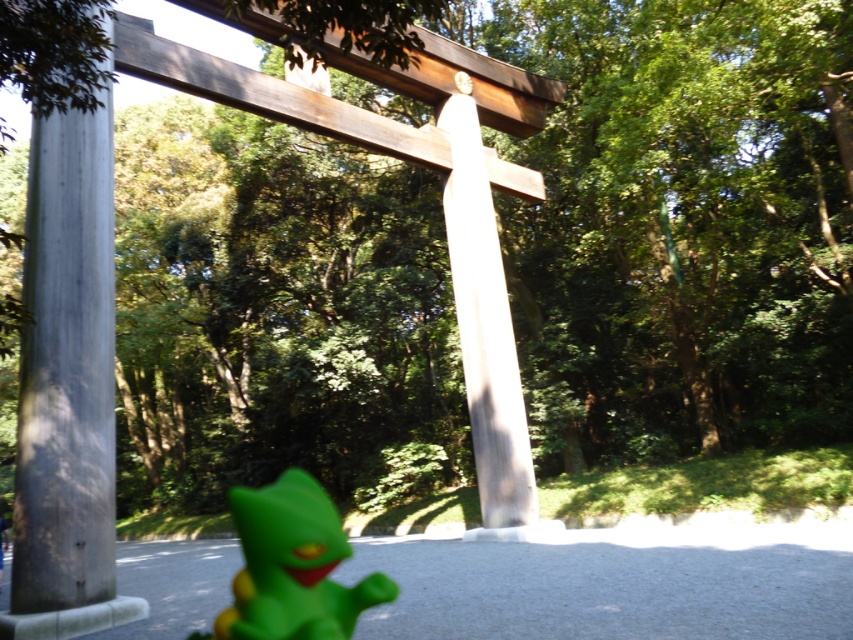
Question: Does smooth gray pole at left appear over smooth white pillar at center?

Choices:
 (A) yes
 (B) no

Answer: (A)

Question: Which object appears farthest from the camera in this image?

Choices:
 (A) smooth white pillar at center
 (B) smooth gray pole at left
 (C) green rubber toy at lower left

Answer: (A)

Question: Does smooth gray pole at left lie behind green rubber toy at lower left?

Choices:
 (A) no
 (B) yes

Answer: (B)

Question: Which point is farther to the camera?

Choices:
 (A) smooth white pillar at center
 (B) smooth gray pole at left
 (C) green rubber toy at lower left

Answer: (A)

Question: Which object is farther from the camera taking this photo?

Choices:
 (A) smooth white pillar at center
 (B) green rubber toy at lower left

Answer: (A)

Question: Is smooth gray pole at left to the right of smooth white pillar at center from the viewer's perspective?

Choices:
 (A) no
 (B) yes

Answer: (A)